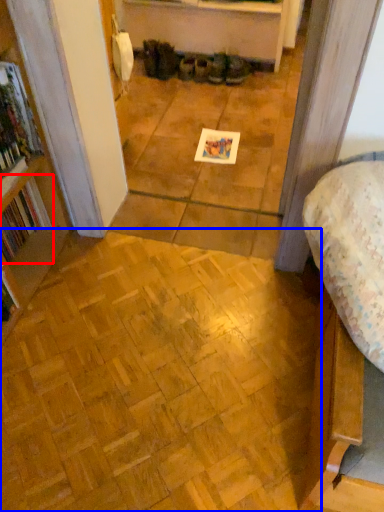
Question: Which object appears farthest to the camera in this image, book (highlighted by a red box) or plywood (highlighted by a blue box)?

Choices:
 (A) book
 (B) plywood

Answer: (A)